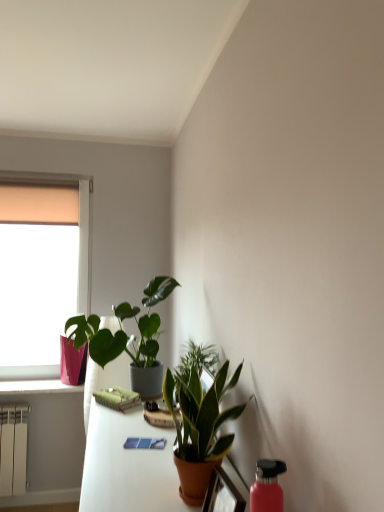
Question: Considering the relative positions of green matte plant at upper center, positioned as the 1th houseplant in back-to-front order, and pink glossy flowerpot at lower left in the image provided, is green matte plant at upper center, positioned as the 1th houseplant in back-to-front order, to the right of pink glossy flowerpot at lower left from the viewer's perspective?

Choices:
 (A) no
 (B) yes

Answer: (B)

Question: From the image's perspective, is green matte plant at upper center, positioned as the 1th houseplant in left-to-right order, below pink glossy flowerpot at lower left?

Choices:
 (A) no
 (B) yes

Answer: (A)

Question: Can you confirm if green matte plant at upper center, positioned as the 1th houseplant in left-to-right order, is smaller than pink glossy flowerpot at lower left?

Choices:
 (A) yes
 (B) no

Answer: (B)

Question: Is green matte plant at upper center, which ranks as the second houseplant in right-to-left order, in contact with pink glossy flowerpot at lower left?

Choices:
 (A) yes
 (B) no

Answer: (B)

Question: Considering the relative positions of green matte plant at upper center, positioned as the 1th houseplant in left-to-right order, and pink glossy flowerpot at lower left in the image provided, is green matte plant at upper center, positioned as the 1th houseplant in left-to-right order, in front of pink glossy flowerpot at lower left?

Choices:
 (A) no
 (B) yes

Answer: (B)

Question: Is pink plastic window sill at left next to pink glossy flowerpot at lower left?

Choices:
 (A) yes
 (B) no

Answer: (B)

Question: From the image's perspective, would you say pink plastic window sill at left is shown under pink glossy flowerpot at lower left?

Choices:
 (A) yes
 (B) no

Answer: (A)

Question: Is pink plastic window sill at left thinner than pink glossy flowerpot at lower left?

Choices:
 (A) yes
 (B) no

Answer: (B)

Question: Is pink plastic window sill at left taller than pink glossy flowerpot at lower left?

Choices:
 (A) no
 (B) yes

Answer: (A)

Question: From a real-world perspective, is pink plastic window sill at left below pink glossy flowerpot at lower left?

Choices:
 (A) no
 (B) yes

Answer: (B)

Question: Is pink plastic window sill at left looking in the opposite direction of pink glossy flowerpot at lower left?

Choices:
 (A) yes
 (B) no

Answer: (B)

Question: Is terracotta ceramic table at center looking in the opposite direction of matte orange pot at lower center?

Choices:
 (A) no
 (B) yes

Answer: (A)